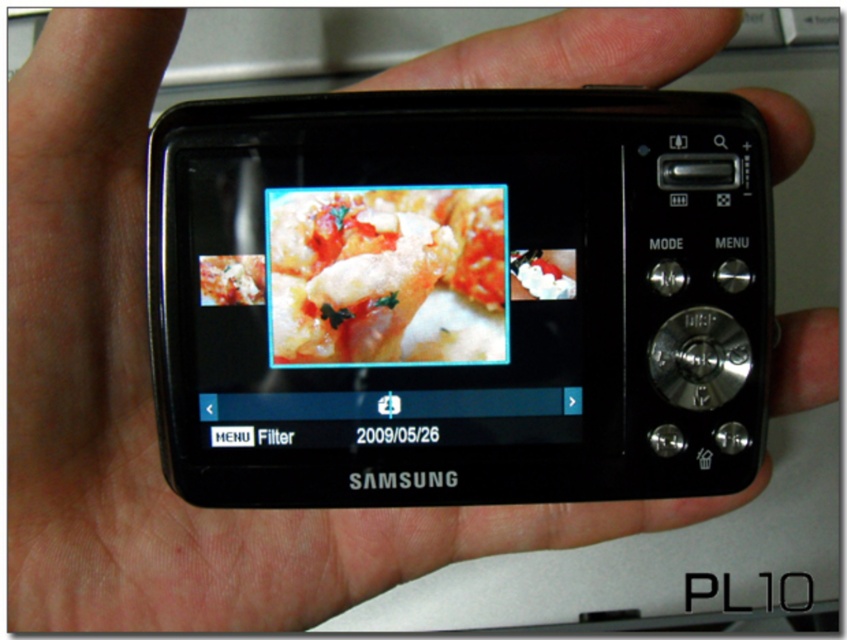
Can you confirm if black glossy screen at center is positioned to the right of shiny tomato sauce at center?

Indeed, black glossy screen at center is positioned on the right side of shiny tomato sauce at center.

Is point (425, 374) farther from camera compared to point (444, 333)?

Yes, it is.

You are a GUI agent. You are given a task and a screenshot of the screen. Output one action in this format:
    pyautogui.click(x=<x>, y=<y>)
    Task: Click on the black glossy screen at center
    The image size is (847, 640).
    Given the screenshot: What is the action you would take?
    pyautogui.click(x=458, y=296)